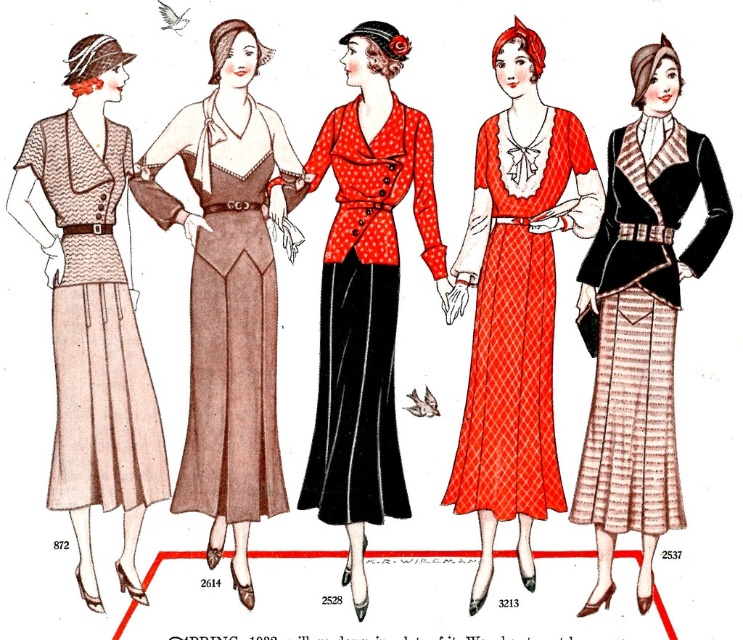
Based on the scene description, which dress is bigger in size between the matte red dress at center and the polka dot fabric dress at center?

The matte red dress at center is larger in size than the polka dot fabric dress at center.

What is the relationship between the widths of the matte red dress at center and the polka dot fabric dress at center?

The matte red dress at center is wider than the polka dot fabric dress at center according to the description.